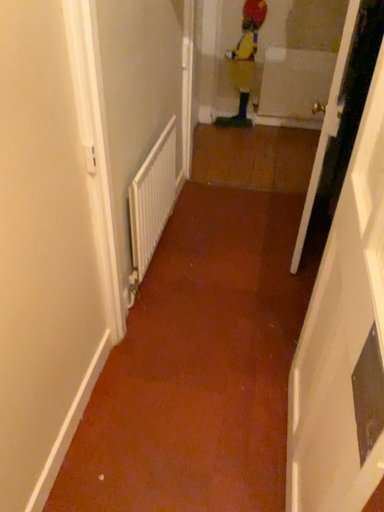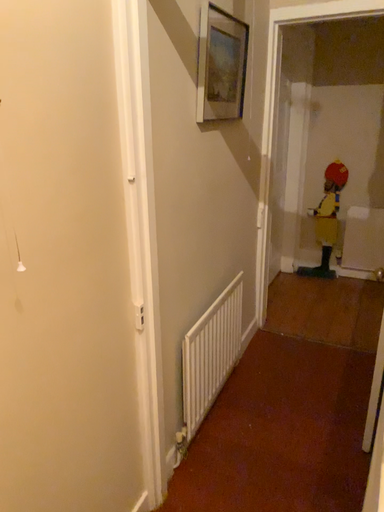
Question: Which way did the camera rotate in the video?

Choices:
 (A) rotated upward
 (B) rotated downward

Answer: (A)